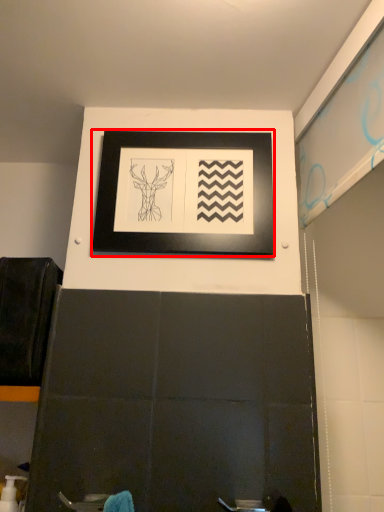
Question: From the image, what is the correct spatial relationship of picture frame (annotated by the red box) in relation to toiletry?

Choices:
 (A) right
 (B) left

Answer: (A)